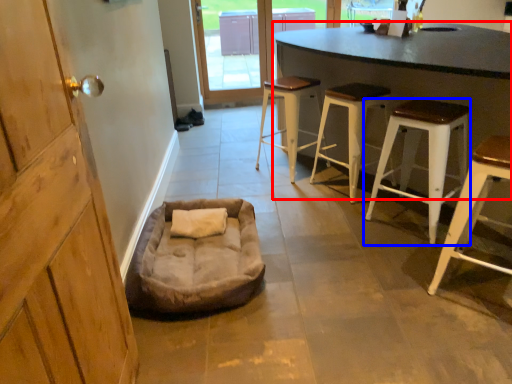
Question: Which object is closer to the camera taking this photo, table (highlighted by a red box) or stool (highlighted by a blue box)?

Choices:
 (A) table
 (B) stool

Answer: (A)